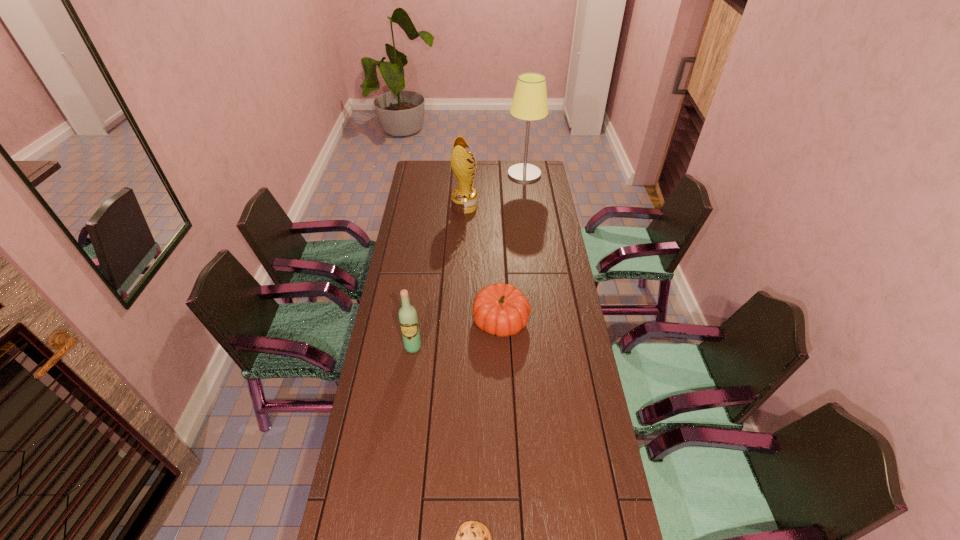
You are a GUI agent. You are given a task and a screenshot of the screen. Output one action in this format:
    pyautogui.click(x=<x>, y=<y>)
    Task: Click on the free point between the wine bottle and the second shortest object
    This screenshot has width=960, height=540.
    Given the screenshot: What is the action you would take?
    pyautogui.click(x=457, y=334)

I want to click on free space between the pumpkin and the award, so (483, 264).

You are a GUI agent. You are given a task and a screenshot of the screen. Output one action in this format:
    pyautogui.click(x=<x>, y=<y>)
    Task: Click on the free area in between the second farthest object and the second shortest object
    
    Given the screenshot: What is the action you would take?
    coord(483,264)

Image resolution: width=960 pixels, height=540 pixels. Find the location of `free space that is in between the second farthest object and the pumpkin`. free space that is in between the second farthest object and the pumpkin is located at coordinates (483, 264).

Locate an element on the screen. empty location between the second farthest object and the pumpkin is located at coordinates (483, 264).

The image size is (960, 540). What are the coordinates of `object that is the closest to the tallest object` in the screenshot? It's located at (464, 199).

Identify the location of the closest object relative to the leftmost object. The height and width of the screenshot is (540, 960). (500, 309).

Identify the location of free space that satisfies the following two spatial constraints: 1. on the front-facing side of the fourth nearest object; 2. on the back side of the pumpkin. (460, 321).

At what (x,y) coordinates should I click in order to perform the action: click on free spot that satisfies the following two spatial constraints: 1. on the front-facing side of the fourth nearest object; 2. on the back side of the pumpkin. Please return your answer as a coordinate pair (x, y). The image size is (960, 540). Looking at the image, I should click on (460, 321).

At what (x,y) coordinates should I click in order to perform the action: click on vacant space that satisfies the following two spatial constraints: 1. on the front-facing side of the second tallest object; 2. on the front-facing side of the wine bottle. Please return your answer as a coordinate pair (x, y). Looking at the image, I should click on (459, 347).